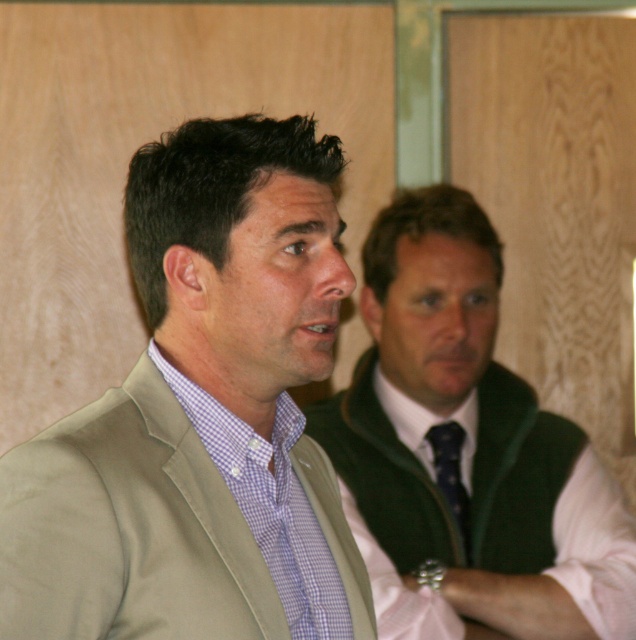
Which of these two, purple checkered shirt at center or dark blue silk tie at center, stands taller?

purple checkered shirt at center is taller.

Does purple checkered shirt at center appear on the right side of dark blue silk tie at center?

Incorrect, purple checkered shirt at center is not on the right side of dark blue silk tie at center.

Identify the location of purple checkered shirt at center. (270, 502).

Find the location of a particular element. The width and height of the screenshot is (636, 640). purple checkered shirt at center is located at coordinates (270, 502).

Which is below, green textured vest at center or dark blue silk tie at center?

dark blue silk tie at center is below.

Is point (438, 420) more distant than point (453, 449)?

That is True.

What do you see at coordinates (467, 448) in the screenshot? The width and height of the screenshot is (636, 640). I see `green textured vest at center` at bounding box center [467, 448].

Where is `green textured vest at center`? Image resolution: width=636 pixels, height=640 pixels. green textured vest at center is located at coordinates (467, 448).

Does point (204, 312) come behind point (457, 432)?

That is False.

Does light beige fabric jacket at center have a greater width compared to dark blue silk tie at center?

Yes.

The image size is (636, 640). Describe the element at coordinates (202, 416) in the screenshot. I see `light beige fabric jacket at center` at that location.

The width and height of the screenshot is (636, 640). Identify the location of light beige fabric jacket at center. (202, 416).